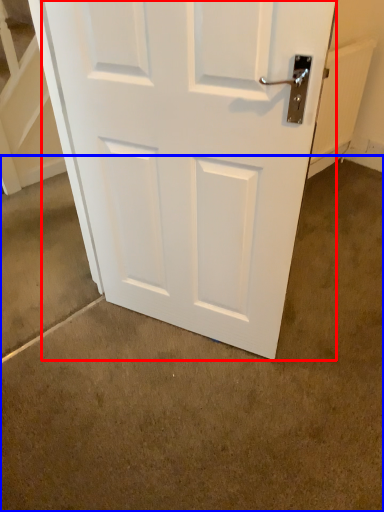
Question: Among these objects, which one is farthest to the camera, door (highlighted by a red box) or concrete (highlighted by a blue box)?

Choices:
 (A) door
 (B) concrete

Answer: (A)